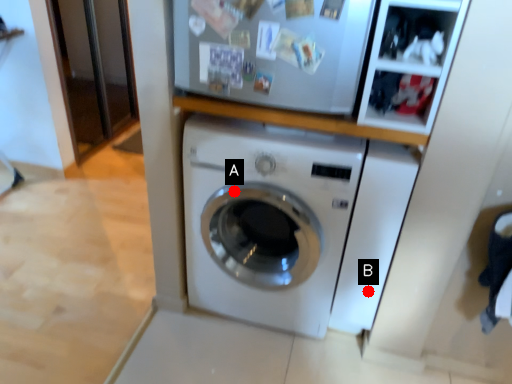
Question: Two points are circled on the image, labeled by A and B beside each circle. Which point is closer to the camera taking this photo?

Choices:
 (A) A is closer
 (B) B is closer

Answer: (A)